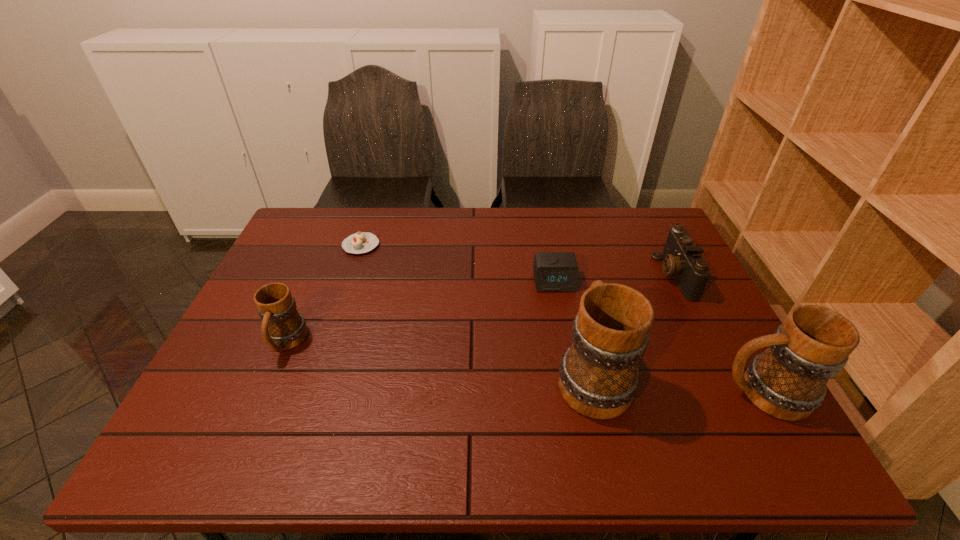
The height and width of the screenshot is (540, 960). Find the location of `vacant space at the near right corner of the desktop`. vacant space at the near right corner of the desktop is located at coordinates (736, 414).

Locate an element on the screen. empty space between the second tallest mug and the second shortest object is located at coordinates (659, 338).

The height and width of the screenshot is (540, 960). Identify the location of vacant region between the shortest object and the second mug from right to left. (476, 310).

This screenshot has height=540, width=960. Find the location of `free space between the second tallest mug and the alarm clock`. free space between the second tallest mug and the alarm clock is located at coordinates (659, 338).

Where is `free area in between the rightmost mug and the camera`? This screenshot has height=540, width=960. free area in between the rightmost mug and the camera is located at coordinates (718, 334).

At what (x,y) coordinates should I click in order to perform the action: click on free space that is in between the alarm clock and the shortest object. Please return your answer as a coordinate pair (x, y). Image resolution: width=960 pixels, height=540 pixels. Looking at the image, I should click on (458, 264).

This screenshot has width=960, height=540. In order to click on empty space between the alarm clock and the fourth shortest object in this screenshot , I will do `click(420, 312)`.

Where is `vacant area that lies between the second shortest object and the cupcake`? This screenshot has height=540, width=960. vacant area that lies between the second shortest object and the cupcake is located at coordinates click(458, 264).

Select which object is the third closest to the alarm clock. Please provide its 2D coordinates. Your answer should be formatted as a tuple, i.e. [(x, y)], where the tuple contains the x and y coordinates of a point satisfying the conditions above.

[(787, 381)]

Where is `the fourth closest object relative to the rightmost mug`? the fourth closest object relative to the rightmost mug is located at coordinates (361, 242).